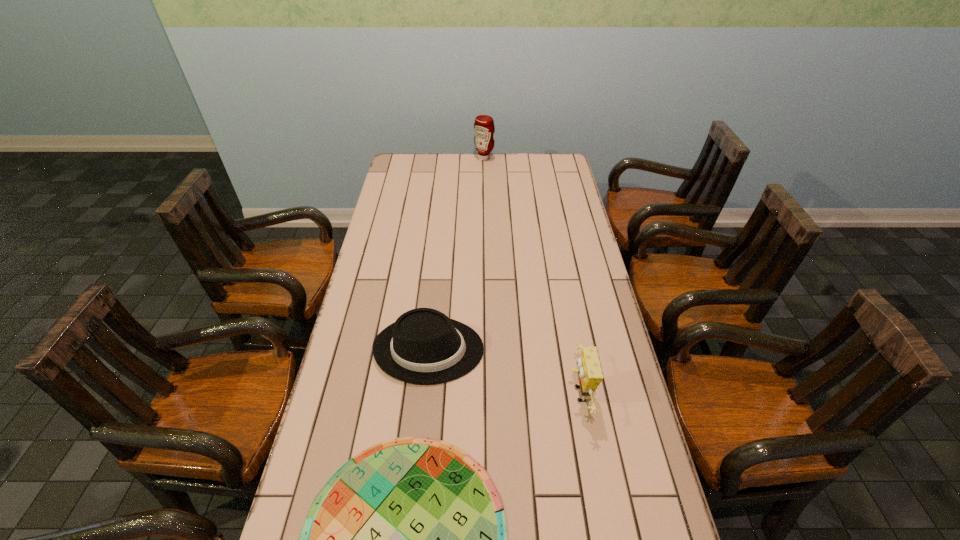
The image size is (960, 540). In order to click on object that is at the far edge in this screenshot , I will do `click(484, 127)`.

This screenshot has height=540, width=960. I want to click on object located at the left edge, so click(x=423, y=346).

This screenshot has width=960, height=540. I want to click on object at the right edge, so click(x=589, y=370).

I want to click on vacant region at the left edge of the desktop, so click(x=391, y=284).

You are a GUI agent. You are given a task and a screenshot of the screen. Output one action in this format:
    pyautogui.click(x=<x>, y=<y>)
    Task: Click on the vacant space at the right edge of the desktop
    The height and width of the screenshot is (540, 960).
    Given the screenshot: What is the action you would take?
    pos(589,291)

In the image, there is a desktop. Where is `vacant space at the far left corner`? The height and width of the screenshot is (540, 960). vacant space at the far left corner is located at coordinates (419, 177).

The width and height of the screenshot is (960, 540). What are the coordinates of `blank area at the far right corner` in the screenshot? It's located at (539, 165).

Where is `empty location between the second tallest object and the fedora`? This screenshot has width=960, height=540. empty location between the second tallest object and the fedora is located at coordinates pyautogui.click(x=504, y=372).

Find the location of `free space that is in between the third tallest object and the rightmost object`. free space that is in between the third tallest object and the rightmost object is located at coordinates (504, 372).

Where is `free spot between the third shortest object and the fedora`? free spot between the third shortest object and the fedora is located at coordinates (504, 372).